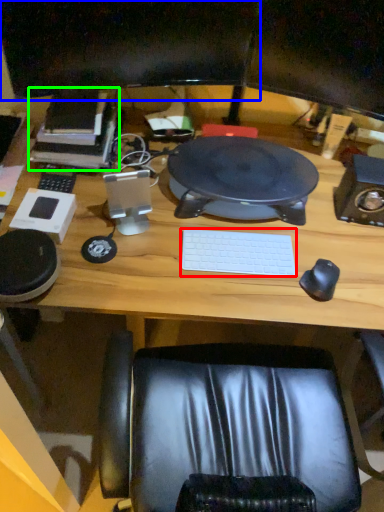
Question: Estimate the real-world distances between objects in this image. Which object is closer to laptop keyboard (highlighted by a red box), computer monitor (highlighted by a blue box) or book (highlighted by a green box)?

Choices:
 (A) computer monitor
 (B) book

Answer: (B)